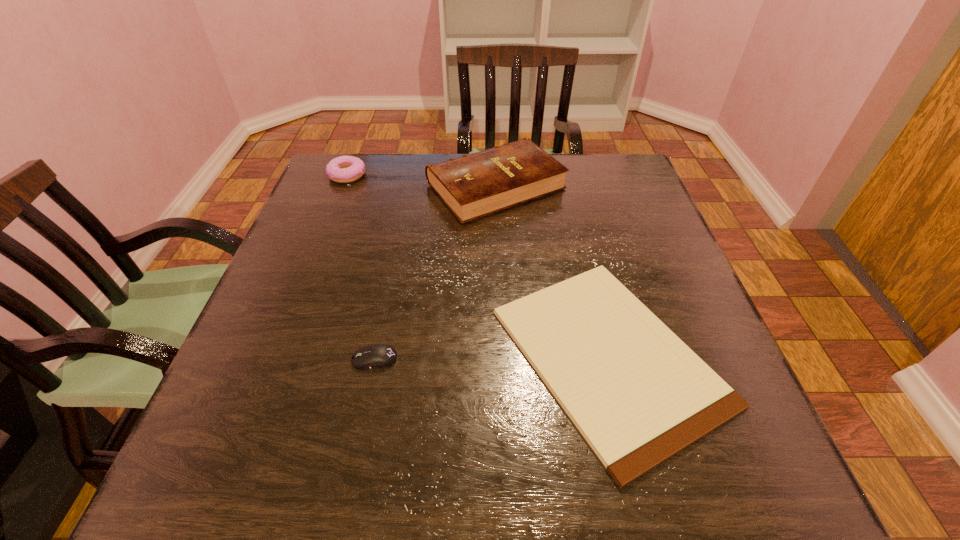
The image size is (960, 540). I want to click on hardback book at the far edge, so click(472, 186).

At what (x,y) coordinates should I click in order to perform the action: click on doughnut present at the far edge. Please return your answer as a coordinate pair (x, y). This screenshot has width=960, height=540. Looking at the image, I should click on (345, 169).

At what (x,y) coordinates should I click in order to perform the action: click on object present at the near edge. Please return your answer as a coordinate pair (x, y). The image size is (960, 540). Looking at the image, I should click on (637, 393).

The width and height of the screenshot is (960, 540). What are the coordinates of `object located in the left edge section of the desktop` in the screenshot? It's located at (345, 169).

Image resolution: width=960 pixels, height=540 pixels. Find the location of `object that is at the right edge`. object that is at the right edge is located at coordinates (637, 393).

You are a GUI agent. You are given a task and a screenshot of the screen. Output one action in this format:
    pyautogui.click(x=<x>, y=<y>)
    Task: Click on the object that is at the far left corner
    The height and width of the screenshot is (540, 960).
    Given the screenshot: What is the action you would take?
    point(345,169)

What are the coordinates of `object located in the near right corner section of the desktop` in the screenshot? It's located at (637, 393).

Locate an element on the screen. The image size is (960, 540). free space at the far edge is located at coordinates (568, 177).

Where is `vacant region at the near edge`? vacant region at the near edge is located at coordinates (346, 490).

Find the location of a particular element. vacant point at the left edge is located at coordinates (322, 274).